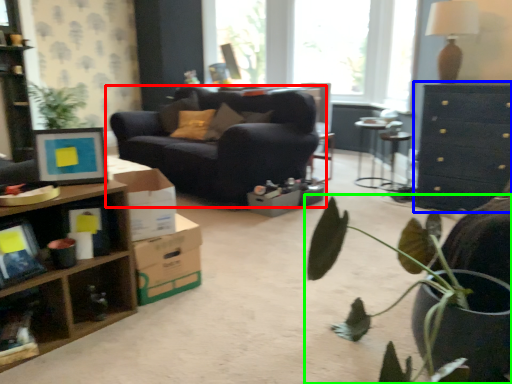
Question: Which object is positioned closest to studio couch (highlighted by a red box)? Select from cabinetry (highlighted by a blue box) and houseplant (highlighted by a green box).

Choices:
 (A) cabinetry
 (B) houseplant

Answer: (A)